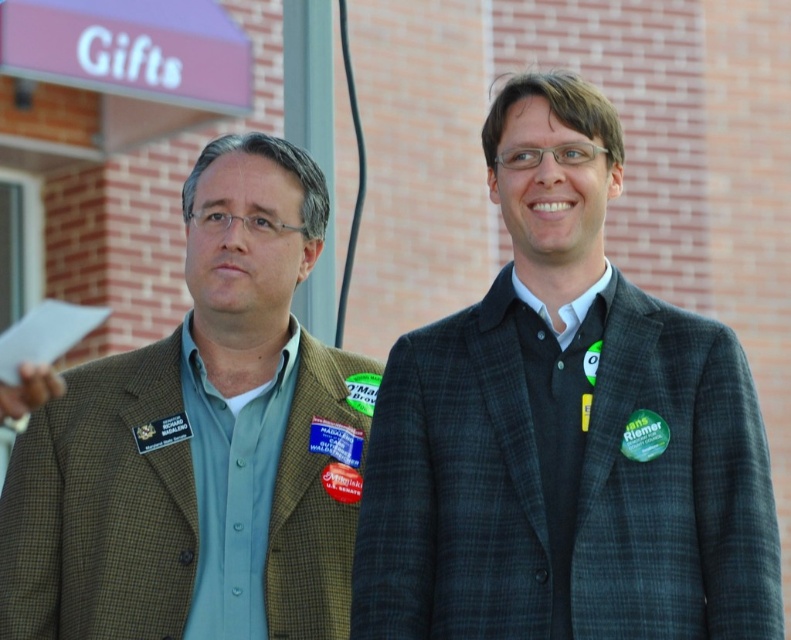
You are a photographer standing in front of the brick building with two people wearing blazers. You want to take a photo that clearly shows both the plaid wool blazer at center and the green plaid blazer at left. Which blazer will appear larger in the photo due to its position?

The plaid wool blazer at center will appear larger in the photo because it is closer to the viewer than the green plaid blazer at left.